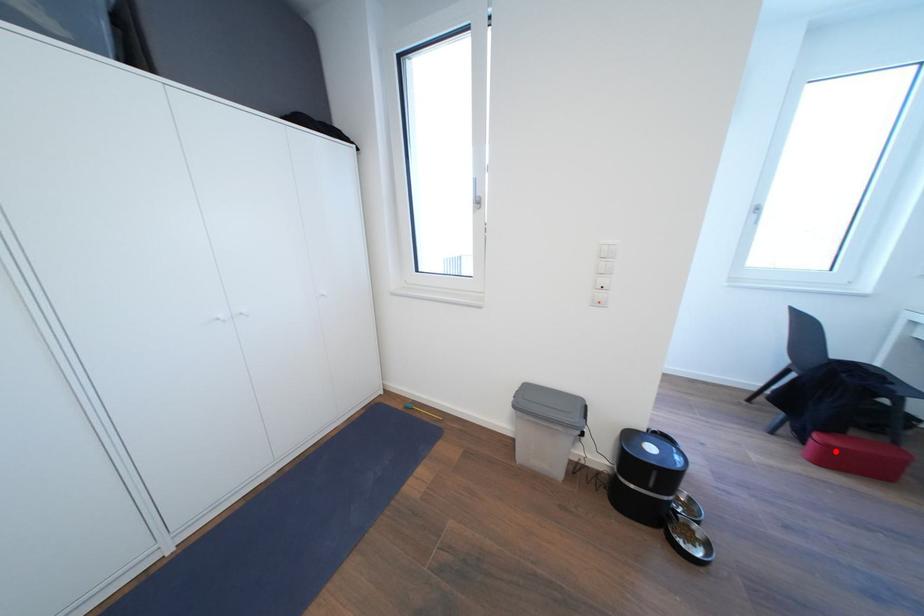
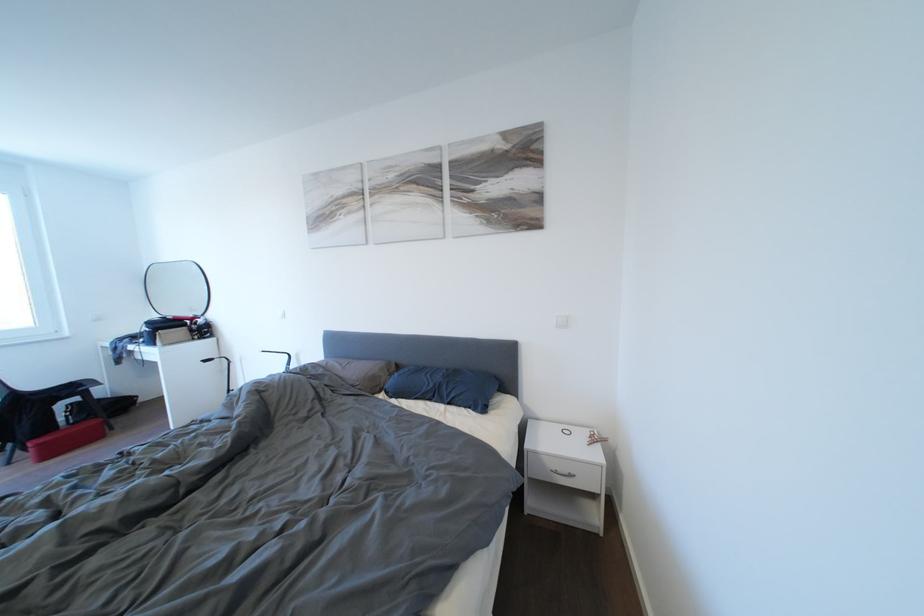
Locate, in the second image, the point that corresponds to the highlighted location in the first image.

(46, 450)